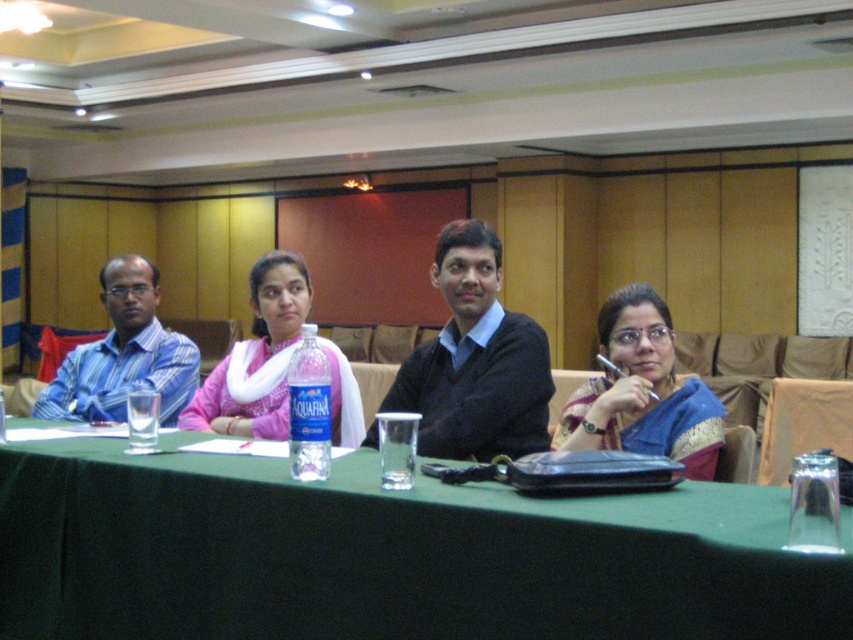
Who is positioned more to the right, green fabric table at center or pink fabric scarf at center?

Positioned to the right is green fabric table at center.

Who is positioned more to the left, green fabric table at center or pink fabric scarf at center?

Positioned to the left is pink fabric scarf at center.

Between point (479, 593) and point (340, 442), which one is positioned in front?

Point (479, 593)

Where is `green fabric table at center`? This screenshot has height=640, width=853. green fabric table at center is located at coordinates (387, 554).

Which is below, pink fabric scarf at center or blue striped shirt at left?

blue striped shirt at left is lower down.

Between point (252, 394) and point (97, 388), which one is positioned behind?

Point (97, 388)

The image size is (853, 640). Identify the location of pink fabric scarf at center. (257, 356).

Which of these two, black sweater at center or blue striped shirt at left, stands shorter?

Standing shorter between the two is blue striped shirt at left.

Between point (518, 339) and point (193, 369), which one is positioned in front?

Point (518, 339) is more forward.

Who is more distant from viewer, (518,330) or (134,321)?

The point (134,321) is more distant.

The image size is (853, 640). I want to click on black sweater at center, so click(474, 360).